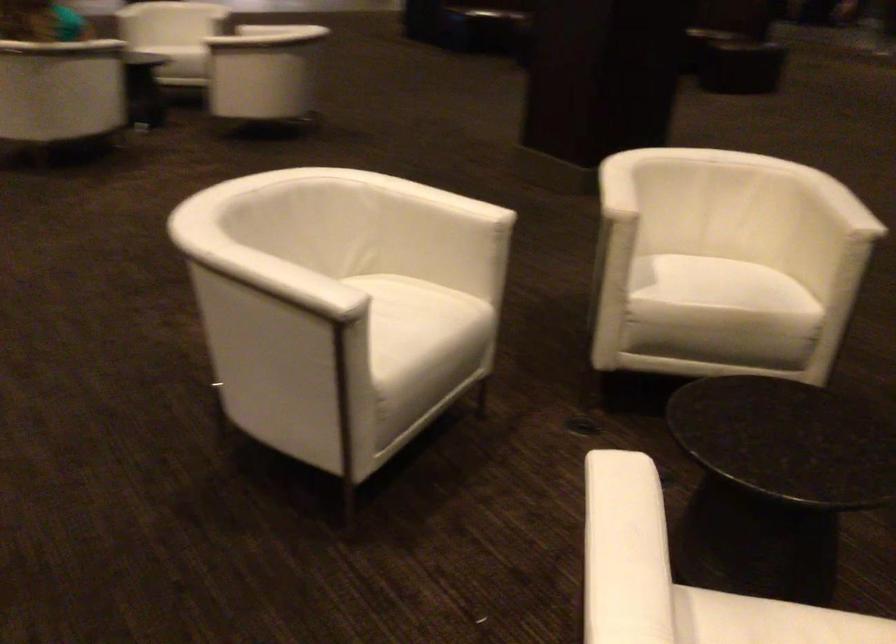
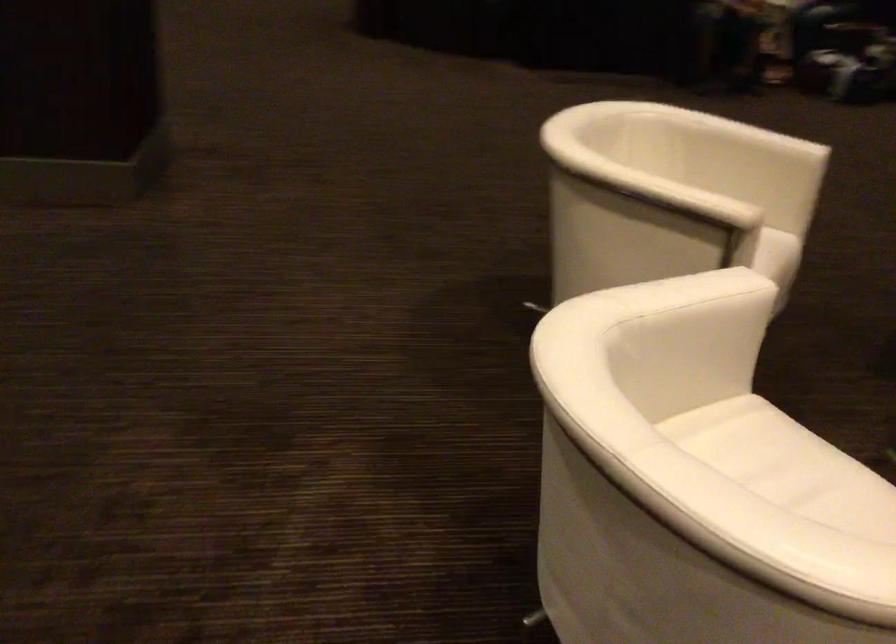
Find the pixel in the second image that matches (613,190) in the first image.

(675, 194)